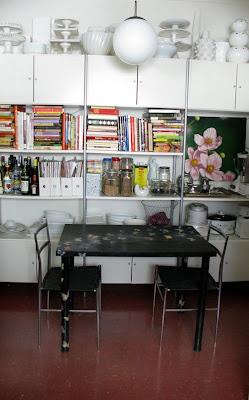
Where is `design painted on table`? This screenshot has width=249, height=400. design painted on table is located at coordinates (66, 297), (64, 345), (63, 333), (61, 276), (63, 265), (68, 243), (122, 233), (173, 233), (189, 233).